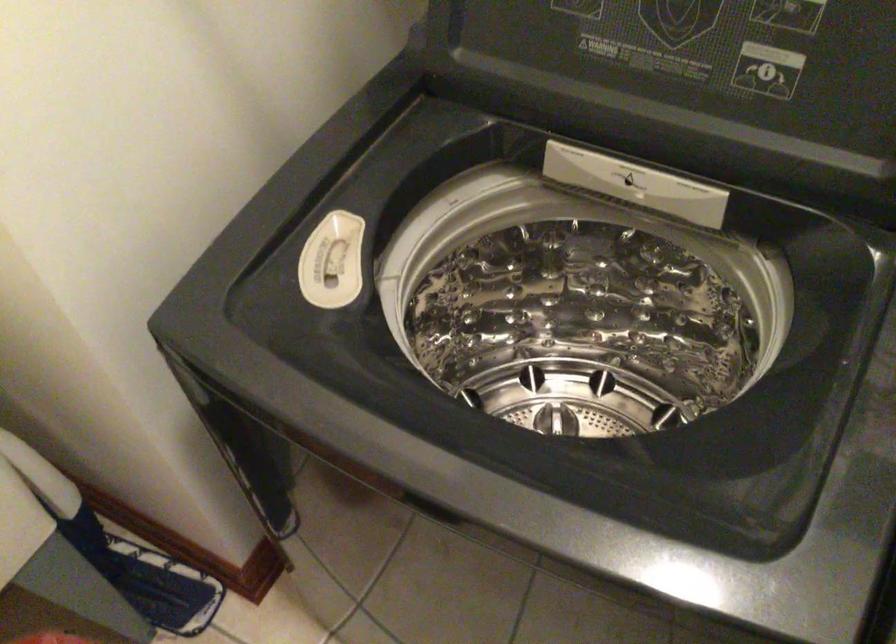
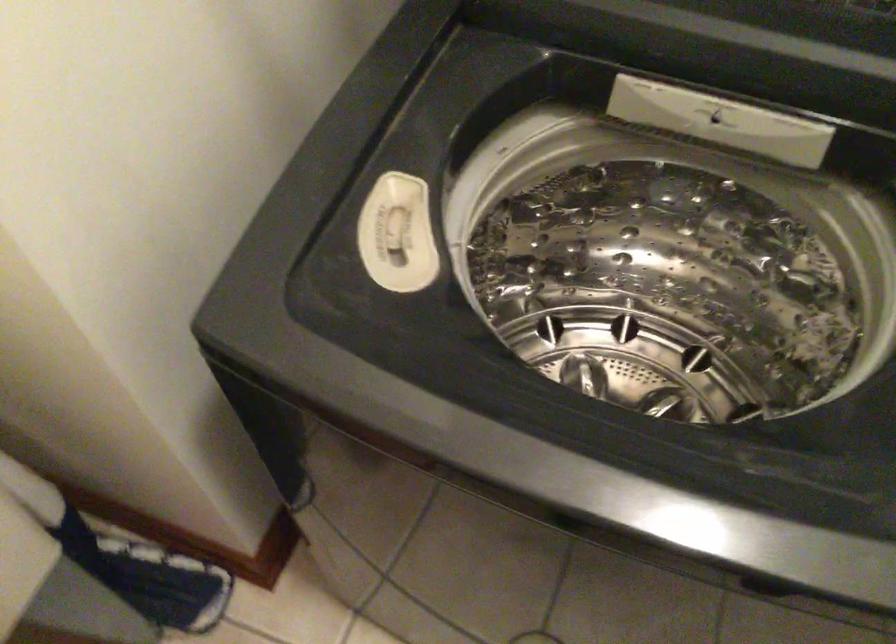
Question: Based on the continuous images, in which direction is the camera rotating? Reply with the corresponding letter.

Choices:
 (A) Left
 (B) Right
 (C) Up
 (D) Down

Answer: (D)